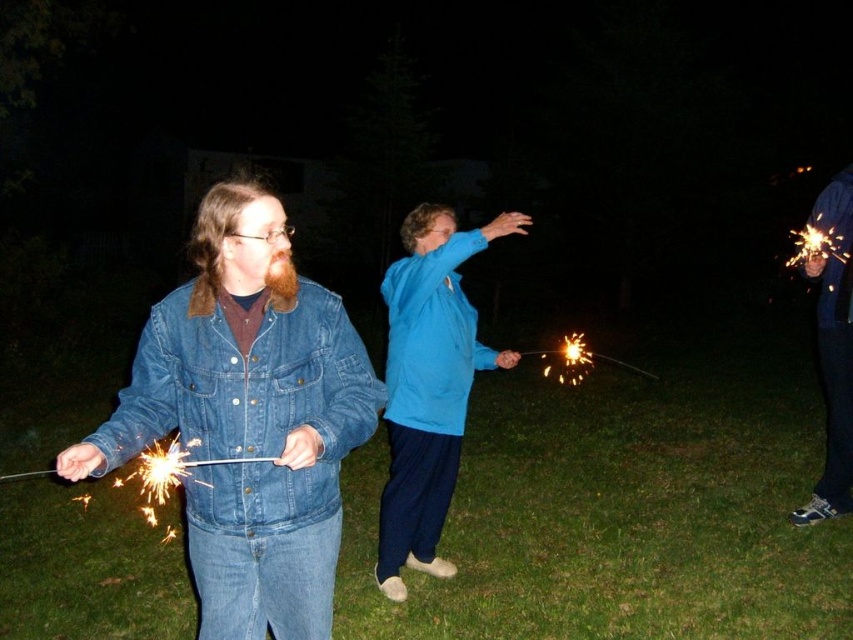
In the nighttime scene, where is the denim jacket at left located in terms of its 2D coordinates?

The denim jacket at left is located at the 2D coordinates of point (248,419).